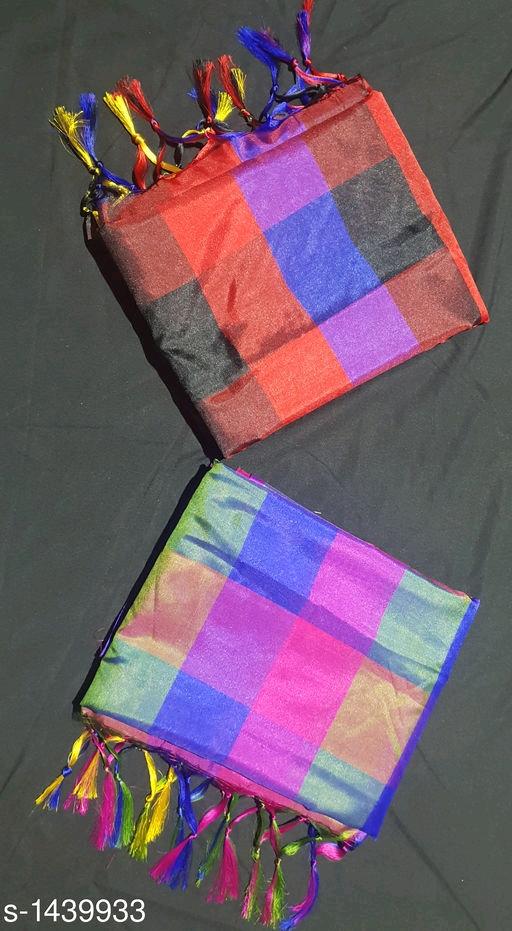
At what (x,y) coordinates should I click in order to perform the action: click on fabric. Please return your answer as a coordinate pair (x, y). Image resolution: width=512 pixels, height=931 pixels. Looking at the image, I should click on (311, 732).